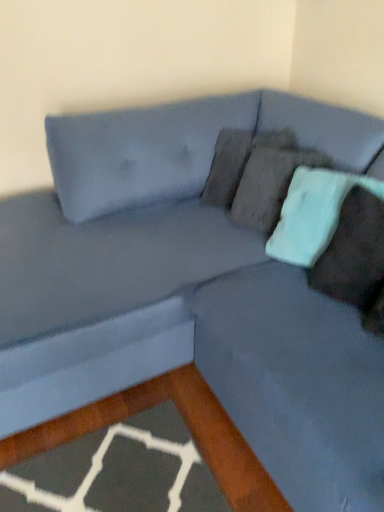
What are the coordinates of `teal fabric pillow at upper right, which ranks as the first pillow in back-to-front order` in the screenshot? It's located at (313, 213).

What do you see at coordinates (313, 213) in the screenshot? I see `teal fabric pillow at upper right, which ranks as the first pillow in back-to-front order` at bounding box center [313, 213].

This screenshot has height=512, width=384. What are the coordinates of `teal fabric pillow at right, the 2th pillow from the back` in the screenshot? It's located at (353, 254).

The width and height of the screenshot is (384, 512). Describe the element at coordinates (353, 254) in the screenshot. I see `teal fabric pillow at right, placed as the 1th pillow when sorted from front to back` at that location.

Locate an element on the screen. Image resolution: width=384 pixels, height=512 pixels. teal fabric pillow at upper right, which ranks as the first pillow in back-to-front order is located at coordinates (313, 213).

Does teal fabric pillow at right, the 2th pillow from the back, appear on the right side of teal fabric pillow at upper right, the second pillow viewed from the front?

Yes, teal fabric pillow at right, the 2th pillow from the back, is to the right of teal fabric pillow at upper right, the second pillow viewed from the front.

Considering their positions, is teal fabric pillow at right, placed as the 1th pillow when sorted from front to back, located in front of or behind teal fabric pillow at upper right, the second pillow viewed from the front?

teal fabric pillow at right, placed as the 1th pillow when sorted from front to back, is in front of teal fabric pillow at upper right, the second pillow viewed from the front.

Is point (359, 301) positioned after point (321, 253)?

No, it is not.

In the scene shown: From the image's perspective, would you say teal fabric pillow at right, the 2th pillow from the back, is shown under teal fabric pillow at upper right, which ranks as the first pillow in back-to-front order?

Yes, from the image's perspective, teal fabric pillow at right, the 2th pillow from the back, is below teal fabric pillow at upper right, which ranks as the first pillow in back-to-front order.

From a real-world perspective, is teal fabric pillow at right, placed as the 1th pillow when sorted from front to back, positioned above or below teal fabric pillow at upper right, the second pillow viewed from the front?

From a real-world perspective, teal fabric pillow at right, placed as the 1th pillow when sorted from front to back, is physically below teal fabric pillow at upper right, the second pillow viewed from the front.

Considering the relative sizes of teal fabric pillow at right, placed as the 1th pillow when sorted from front to back, and teal fabric pillow at upper right, which ranks as the first pillow in back-to-front order, in the image provided, is teal fabric pillow at right, placed as the 1th pillow when sorted from front to back, thinner than teal fabric pillow at upper right, which ranks as the first pillow in back-to-front order,?

No, teal fabric pillow at right, placed as the 1th pillow when sorted from front to back, is not thinner than teal fabric pillow at upper right, which ranks as the first pillow in back-to-front order.

Between teal fabric pillow at right, placed as the 1th pillow when sorted from front to back, and teal fabric pillow at upper right, the second pillow viewed from the front, which one has more height?

With more height is teal fabric pillow at upper right, the second pillow viewed from the front.

Considering the sizes of objects teal fabric pillow at right, the 2th pillow from the back, and teal fabric pillow at upper right, which ranks as the first pillow in back-to-front order, in the image provided, who is bigger, teal fabric pillow at right, the 2th pillow from the back, or teal fabric pillow at upper right, which ranks as the first pillow in back-to-front order,?

teal fabric pillow at upper right, which ranks as the first pillow in back-to-front order.

Is teal fabric pillow at right, the 2th pillow from the back, inside or outside of teal fabric pillow at upper right, which ranks as the first pillow in back-to-front order?

teal fabric pillow at right, the 2th pillow from the back, is spatially positioned inside teal fabric pillow at upper right, which ranks as the first pillow in back-to-front order.

Would you say teal fabric pillow at right, the 2th pillow from the back, is a long distance from teal fabric pillow at upper right, which ranks as the first pillow in back-to-front order?

No, teal fabric pillow at right, the 2th pillow from the back, is not far from teal fabric pillow at upper right, which ranks as the first pillow in back-to-front order.

Is teal fabric pillow at right, placed as the 1th pillow when sorted from front to back, facing away from teal fabric pillow at upper right, the second pillow viewed from the front?

No, teal fabric pillow at right, placed as the 1th pillow when sorted from front to back,'s orientation is not away from teal fabric pillow at upper right, the second pillow viewed from the front.

How many degrees apart are the facing directions of teal fabric pillow at right, placed as the 1th pillow when sorted from front to back, and teal fabric pillow at upper right, the second pillow viewed from the front?

The angle between the facing direction of teal fabric pillow at right, placed as the 1th pillow when sorted from front to back, and the facing direction of teal fabric pillow at upper right, the second pillow viewed from the front, is 0.000499 degrees.

Could you measure the distance between teal fabric pillow at right, placed as the 1th pillow when sorted from front to back, and teal fabric pillow at upper right, which ranks as the first pillow in back-to-front order?

The distance of teal fabric pillow at right, placed as the 1th pillow when sorted from front to back, from teal fabric pillow at upper right, which ranks as the first pillow in back-to-front order, is 12.80 centimeters.

Find the location of a particular element. This screenshot has height=512, width=384. pillow lying in front of the teal fabric pillow at upper right, which ranks as the first pillow in back-to-front order is located at coordinates (353, 254).

In the scene shown: Can you confirm if teal fabric pillow at upper right, which ranks as the first pillow in back-to-front order, is positioned to the right of teal fabric pillow at right, placed as the 1th pillow when sorted from front to back?

In fact, teal fabric pillow at upper right, which ranks as the first pillow in back-to-front order, is to the left of teal fabric pillow at right, placed as the 1th pillow when sorted from front to back.

Is teal fabric pillow at upper right, which ranks as the first pillow in back-to-front order, closer to camera compared to teal fabric pillow at right, the 2th pillow from the back?

No, teal fabric pillow at upper right, which ranks as the first pillow in back-to-front order, is behind teal fabric pillow at right, the 2th pillow from the back.

Considering the positions of points (317, 194) and (350, 214), is point (317, 194) farther from camera compared to point (350, 214)?

Yes.

From the image's perspective, is teal fabric pillow at upper right, the second pillow viewed from the front, above or below teal fabric pillow at right, the 2th pillow from the back?

Based on their image positions, teal fabric pillow at upper right, the second pillow viewed from the front, is located above teal fabric pillow at right, the 2th pillow from the back.

From a real-world perspective, is teal fabric pillow at upper right, the second pillow viewed from the front, under teal fabric pillow at right, the 2th pillow from the back?

Incorrect, from a real-world perspective, teal fabric pillow at upper right, the second pillow viewed from the front, is higher than teal fabric pillow at right, the 2th pillow from the back.

Consider the image. Is teal fabric pillow at upper right, which ranks as the first pillow in back-to-front order, wider or thinner than teal fabric pillow at right, the 2th pillow from the back?

In the image, teal fabric pillow at upper right, which ranks as the first pillow in back-to-front order, appears to be more narrow than teal fabric pillow at right, the 2th pillow from the back.

Does teal fabric pillow at upper right, which ranks as the first pillow in back-to-front order, have a lesser height compared to teal fabric pillow at right, placed as the 1th pillow when sorted from front to back?

No, teal fabric pillow at upper right, which ranks as the first pillow in back-to-front order, is not shorter than teal fabric pillow at right, placed as the 1th pillow when sorted from front to back.

In terms of size, does teal fabric pillow at upper right, the second pillow viewed from the front, appear bigger or smaller than teal fabric pillow at right, placed as the 1th pillow when sorted from front to back?

Considering their sizes, teal fabric pillow at upper right, the second pillow viewed from the front, takes up more space than teal fabric pillow at right, placed as the 1th pillow when sorted from front to back.

Is teal fabric pillow at upper right, which ranks as the first pillow in back-to-front order, situated inside teal fabric pillow at right, placed as the 1th pillow when sorted from front to back, or outside?

teal fabric pillow at upper right, which ranks as the first pillow in back-to-front order, cannot be found inside teal fabric pillow at right, placed as the 1th pillow when sorted from front to back.

Is teal fabric pillow at upper right, the second pillow viewed from the front, positioned far away from teal fabric pillow at right, the 2th pillow from the back?

No.

Does teal fabric pillow at upper right, the second pillow viewed from the front, turn towards teal fabric pillow at right, the 2th pillow from the back?

No, teal fabric pillow at upper right, the second pillow viewed from the front, does not turn towards teal fabric pillow at right, the 2th pillow from the back.

Consider the image. What's the angular difference between teal fabric pillow at upper right, the second pillow viewed from the front, and teal fabric pillow at right, the 2th pillow from the back,'s facing directions?

There is a 0.000499-degree angle between the facing directions of teal fabric pillow at upper right, the second pillow viewed from the front, and teal fabric pillow at right, the 2th pillow from the back.

Where is `pillow below the teal fabric pillow at upper right, which ranks as the first pillow in back-to-front order (from the image's perspective)`? pillow below the teal fabric pillow at upper right, which ranks as the first pillow in back-to-front order (from the image's perspective) is located at coordinates (353, 254).

At what (x,y) coordinates should I click in order to perform the action: click on pillow that is under the teal fabric pillow at upper right, which ranks as the first pillow in back-to-front order (from a real-world perspective). Please return your answer as a coordinate pair (x, y). Looking at the image, I should click on (353, 254).

This screenshot has height=512, width=384. Identify the location of pillow behind the teal fabric pillow at right, placed as the 1th pillow when sorted from front to back. (313, 213).